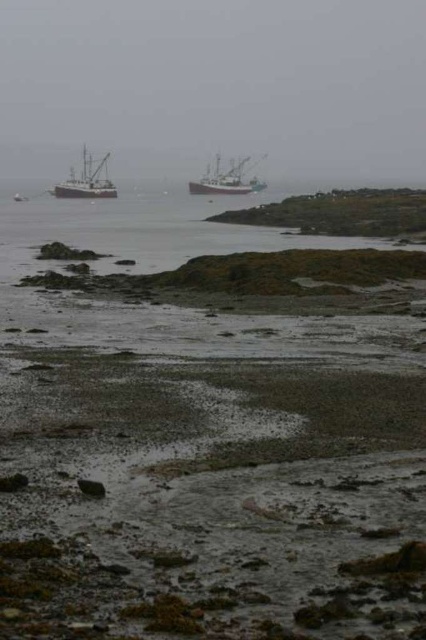
You are a marine biologist who needs to locate the metallic gray fishing boat at left for a study on coastal vessel positioning. Using the coordinate system where the bottom left corner of the image is the origin, can you confirm if the boat is positioned closer to the left edge of the image?

The metallic gray fishing boat at left is located at coordinates approximately 0.283 on the x and 0.204 on the y axis. Since the x coordinate is 0.283, which is closer to the left edge than the center, the boat is positioned closer to the left edge of the image.